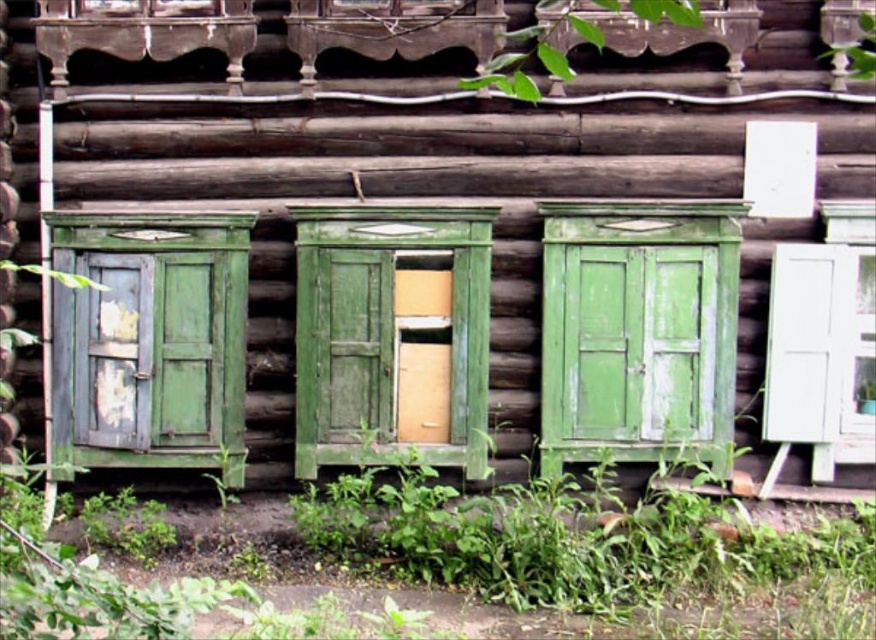
Question: Observing the image, what is the correct spatial positioning of green matte cabinet at left in reference to green leafy plant at upper center?

Choices:
 (A) above
 (B) below

Answer: (B)

Question: Which object is closer to the camera taking this photo?

Choices:
 (A) green leafy plant at upper right
 (B) green wood cabinet at center
 (C) green matte cabinet at center

Answer: (A)

Question: Can you confirm if green matte cabinet at center is positioned to the right of green wood cabinet at center?

Choices:
 (A) no
 (B) yes

Answer: (B)

Question: Is green wood cabinet at center below green matte cabinet at left?

Choices:
 (A) yes
 (B) no

Answer: (B)

Question: Which object is closer to the camera taking this photo?

Choices:
 (A) green wood cabinet at center
 (B) green leafy plant at upper right

Answer: (B)

Question: Based on their relative distances, which object is farther from the green matte cabinet at left?

Choices:
 (A) green leafy plant at upper center
 (B) green matte cabinet at center
 (C) green leafy plant at upper right
 (D) green wood cabinet at center

Answer: (C)